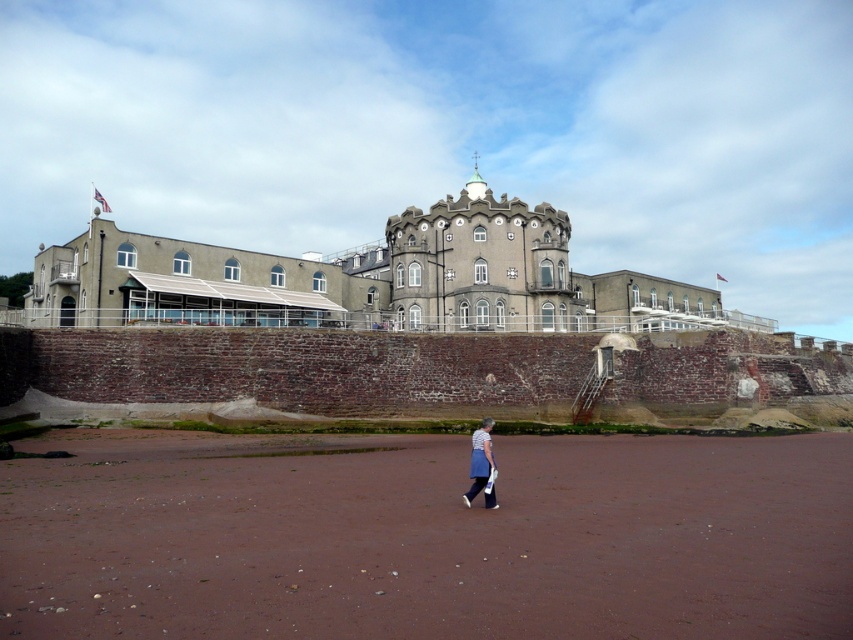
Question: Does gray stone castle at center have a larger size compared to blue denim skirt at lower center?

Choices:
 (A) yes
 (B) no

Answer: (A)

Question: Does gray stone castle at center have a lesser width compared to blue denim skirt at lower center?

Choices:
 (A) yes
 (B) no

Answer: (B)

Question: Among these points, which one is nearest to the camera?

Choices:
 (A) (460, 252)
 (B) (492, 504)

Answer: (B)

Question: Can you confirm if gray stone castle at center is positioned to the right of blue denim skirt at lower center?

Choices:
 (A) yes
 (B) no

Answer: (A)